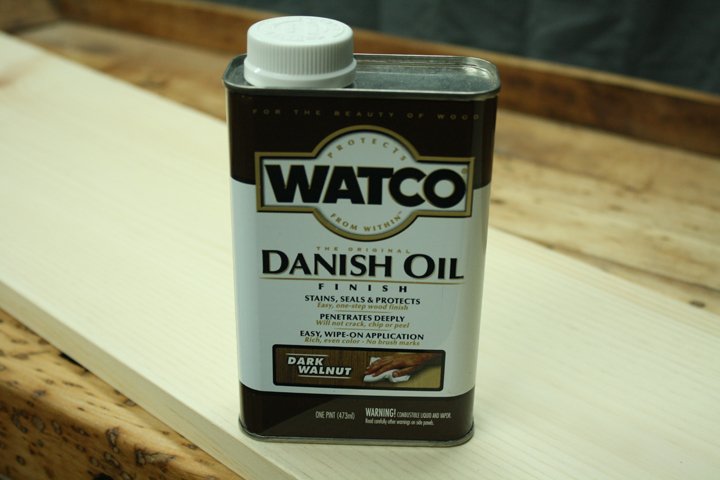
Identify the location of white wooden surface. This screenshot has height=480, width=720. (536, 413).